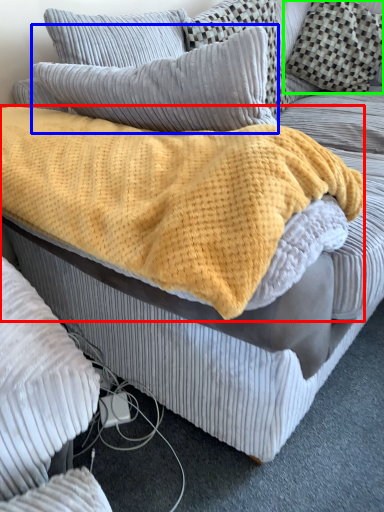
Question: Estimate the real-world distances between objects in this image. Which object is farther from blanket (highlighted by a red box), pillow (highlighted by a blue box) or pillow (highlighted by a green box)?

Choices:
 (A) pillow
 (B) pillow

Answer: (B)